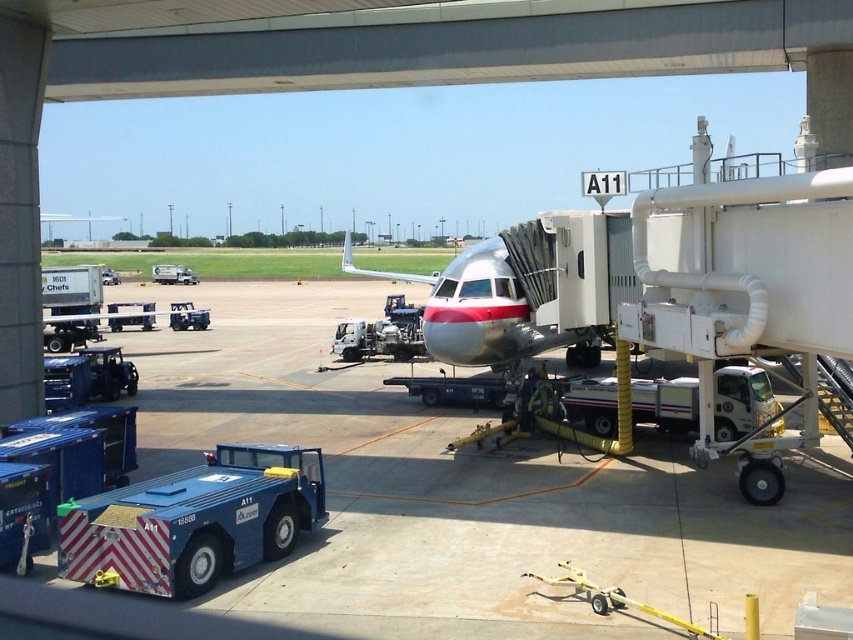
Question: Is blue metallic tug at lower left behind polished aluminum airplane at center?

Choices:
 (A) no
 (B) yes

Answer: (A)

Question: Which point is closer to the camera?

Choices:
 (A) blue metallic tug at lower left
 (B) polished aluminum airplane at center

Answer: (A)

Question: Is blue metallic tug at lower left to the left of polished aluminum airplane at center from the viewer's perspective?

Choices:
 (A) no
 (B) yes

Answer: (B)

Question: Is blue metallic tug at lower left below polished aluminum airplane at center?

Choices:
 (A) no
 (B) yes

Answer: (B)